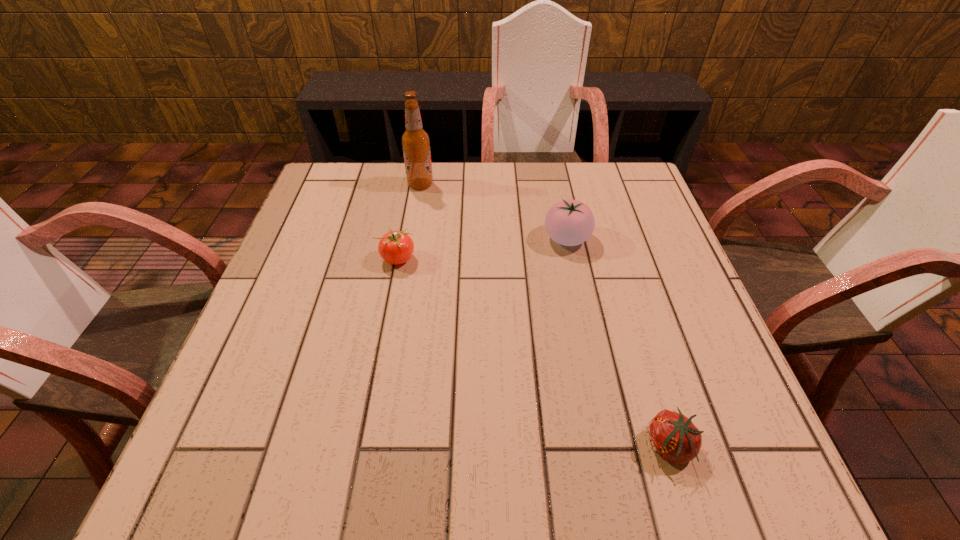
The height and width of the screenshot is (540, 960). In order to click on empty space that is in between the farthest object and the leftmost tomato in this screenshot , I will do `click(409, 222)`.

I want to click on free spot between the shortest tomato and the third shortest object, so click(x=618, y=342).

Find the location of `vacant area between the beer bottle and the leftmost tomato`. vacant area between the beer bottle and the leftmost tomato is located at coordinates (409, 222).

Find the location of `empty space between the second tallest object and the shortest tomato`. empty space between the second tallest object and the shortest tomato is located at coordinates (618, 342).

Identify the location of vacant area that lies between the third shortest object and the beer bottle. (493, 212).

Identify the location of vacant space in between the third shortest object and the beer bottle. The height and width of the screenshot is (540, 960). (493, 212).

This screenshot has height=540, width=960. Find the location of `free point between the leftmost tomato and the third shortest object`. free point between the leftmost tomato and the third shortest object is located at coordinates (482, 249).

The height and width of the screenshot is (540, 960). In order to click on vacant space in between the second tallest object and the nearest tomato in this screenshot , I will do `click(618, 342)`.

Where is `vacant space that is in between the leftmost tomato and the shortest object`? The image size is (960, 540). vacant space that is in between the leftmost tomato and the shortest object is located at coordinates (534, 353).

Identify the location of the closest object to the farthest object. The height and width of the screenshot is (540, 960). (395, 247).